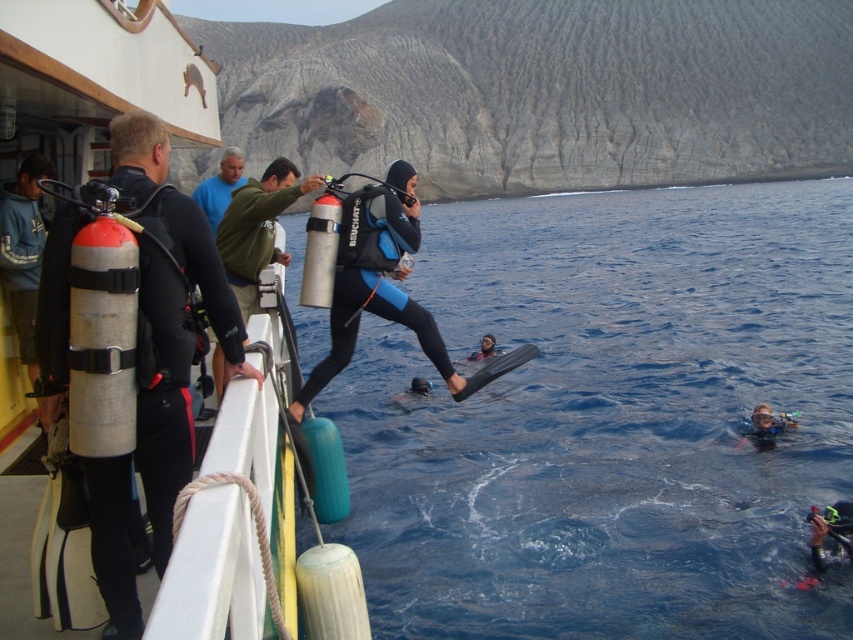
You are a scuba diver observing the scene from the boat. You notice the blue water at center and the black matte wetsuit at center. Which object takes up more space in the image?

The blue water at center takes up more space in the image because it has a larger size compared to the black matte wetsuit at center.

You are a scuba diver on the boat and want to jump into the water. Which direction should you jump to land in the blue water at center without hitting the black matte wetsuit at center?

The blue water at center is positioned on the right side of the black matte wetsuit at center, so you should jump to the right to land in the blue water at center while avoiding the black matte wetsuit at center.